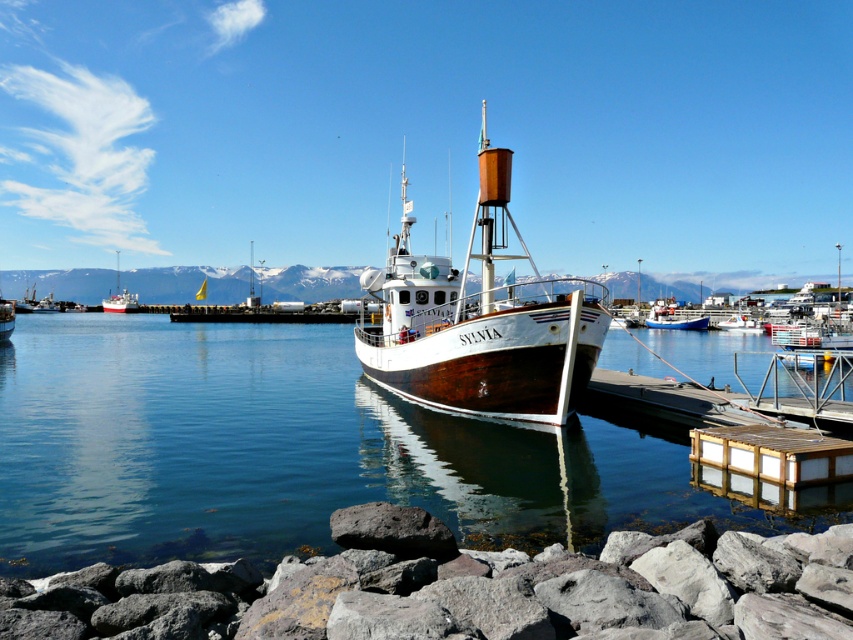
You are a photographer planning to take a photo of the harbor scene. You want to capture both the white wood boat at center and the white glossy boat at left in your shot. Based on their positions, which boat should you position closer to the left edge of your camera frame?

The white glossy boat at left should be positioned closer to the left edge of the camera frame since it is located to the left of the white wood boat at center.

You are standing at the edge of the harbor, and you want to reach the point marked as point (405, 384). If your walking speed is 1.5 meters per second, how long will it take you to reach that point?

The point (405, 384) is 21.13 meters from the viewer. At a walking speed of 1.5 meters per second, it will take approximately 14.09 seconds to reach the point.